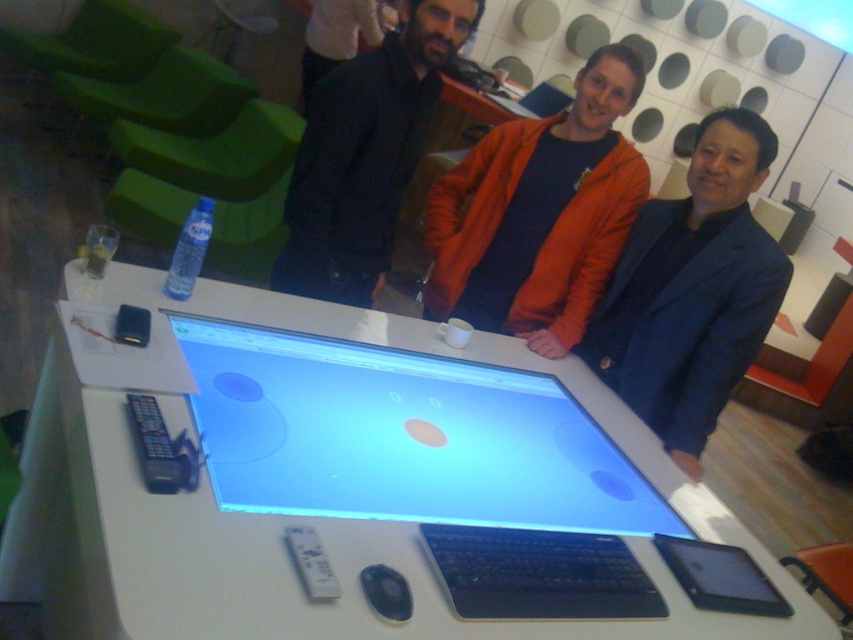
Can you confirm if orange fleece jacket at center is taller than matte black laptop at center?

Correct, orange fleece jacket at center is much taller as matte black laptop at center.

Is orange fleece jacket at center to the left of matte black laptop at center from the viewer's perspective?

Indeed, orange fleece jacket at center is positioned on the left side of matte black laptop at center.

What are the coordinates of `orange fleece jacket at center` in the screenshot? It's located at (538, 212).

You are a GUI agent. You are given a task and a screenshot of the screen. Output one action in this format:
    pyautogui.click(x=<x>, y=<y>)
    Task: Click on the orange fleece jacket at center
    The height and width of the screenshot is (640, 853).
    Given the screenshot: What is the action you would take?
    pyautogui.click(x=538, y=212)

Which is above, white glossy table at center or matte black laptop at center?

Positioned higher is matte black laptop at center.

What do you see at coordinates (361, 484) in the screenshot? This screenshot has height=640, width=853. I see `white glossy table at center` at bounding box center [361, 484].

This screenshot has width=853, height=640. Describe the element at coordinates (361, 484) in the screenshot. I see `white glossy table at center` at that location.

Find the location of a particular element. This screenshot has height=640, width=853. white glossy table at center is located at coordinates (361, 484).

Where is `white glossy table at center`? This screenshot has height=640, width=853. white glossy table at center is located at coordinates (361, 484).

Is white glossy table at center above dark blue jacket at center?

No, white glossy table at center is not above dark blue jacket at center.

What do you see at coordinates (361, 484) in the screenshot? Image resolution: width=853 pixels, height=640 pixels. I see `white glossy table at center` at bounding box center [361, 484].

The width and height of the screenshot is (853, 640). In order to click on white glossy table at center in this screenshot , I will do `click(361, 484)`.